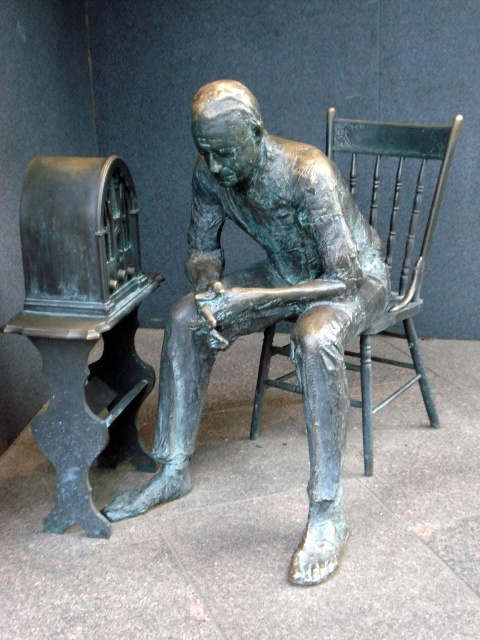
Question: Does bronze statue at center lie in front of green wooden chair at center?

Choices:
 (A) no
 (B) yes

Answer: (B)

Question: Which point appears closest to the camera in this image?

Choices:
 (A) (312, 365)
 (B) (398, 248)

Answer: (A)

Question: Can you confirm if bronze statue at center is thinner than green wooden chair at center?

Choices:
 (A) no
 (B) yes

Answer: (A)

Question: Does bronze statue at center appear under green wooden chair at center?

Choices:
 (A) yes
 (B) no

Answer: (A)